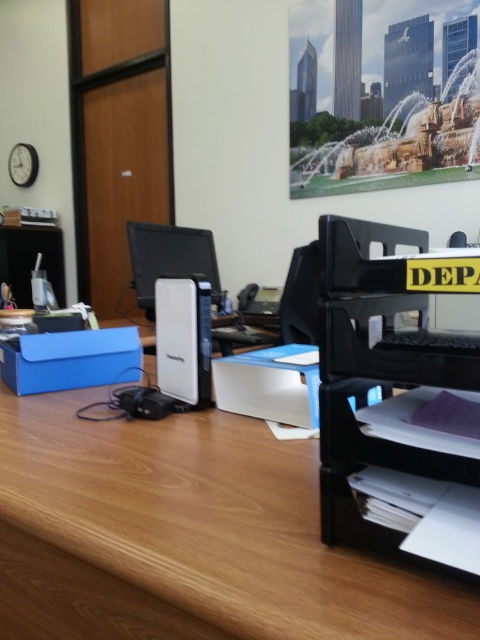
Question: Which object appears closest to the camera in this image?

Choices:
 (A) white matte box at center
 (B) blue matte box at left

Answer: (A)

Question: Which of these objects is positioned closest to the wooden at center?

Choices:
 (A) white matte box at center
 (B) black plastic printer at right

Answer: (A)

Question: Which point is farther to the camera?

Choices:
 (A) (331, 584)
 (B) (252, 365)
 (C) (4, 348)
 (D) (170, 236)

Answer: (D)

Question: Does white matte box at center have a smaller size compared to white plastic desktop computer at center?

Choices:
 (A) yes
 (B) no

Answer: (A)

Question: Does black plastic printer at right have a lesser width compared to blue matte box at left?

Choices:
 (A) yes
 (B) no

Answer: (A)

Question: Can you confirm if wooden at center is positioned above white matte box at center?

Choices:
 (A) yes
 (B) no

Answer: (B)